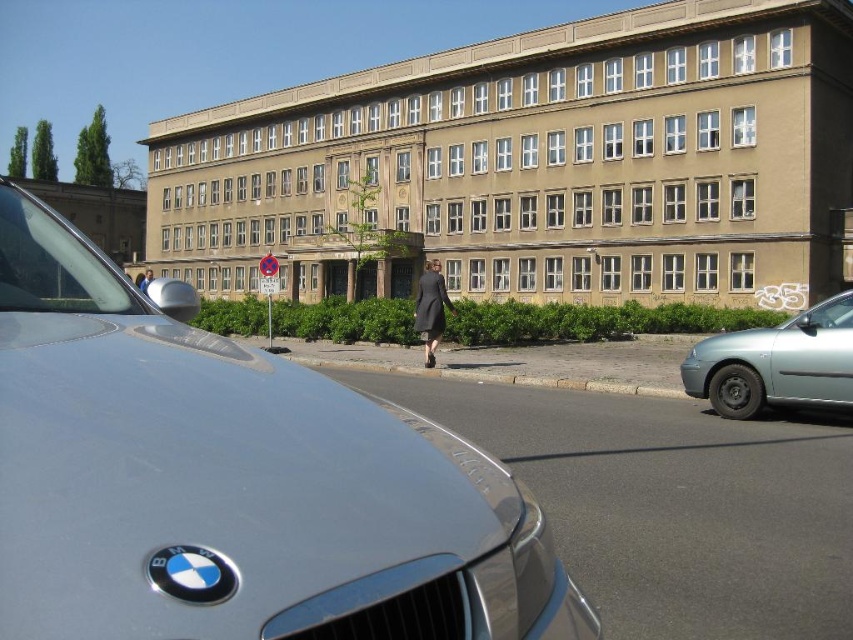
Who is taller, sleek silver car at center or silver metallic sedan at right?

With more height is sleek silver car at center.

Between point (399, 588) and point (776, 388), which one is positioned behind?

The point (776, 388) is behind.

Is point (125, 339) positioned after point (822, 333)?

No, (125, 339) is closer to viewer.

Where is `sleek silver car at center`? The image size is (853, 640). sleek silver car at center is located at coordinates (231, 481).

Identify the location of silver metallic sedan at right. The width and height of the screenshot is (853, 640). (776, 364).

Who is more forward, (740,400) or (149,276)?

Point (740,400) is in front.

The height and width of the screenshot is (640, 853). I want to click on silver metallic sedan at right, so click(776, 364).

Who is more distant from viewer, [113,397] or [142,276]?

The point [142,276] is behind.

Is point (30, 435) closer to camera compared to point (143, 285)?

Yes, it is.

The height and width of the screenshot is (640, 853). What are the coordinates of `sleek silver car at center` in the screenshot? It's located at (231, 481).